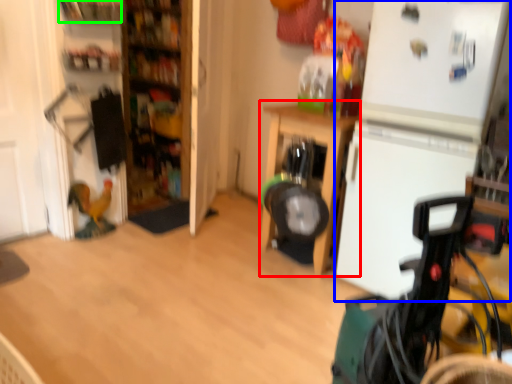
Question: Which object is positioned farthest from furniture (highlighted by a red box)? Select from fridge (highlighted by a blue box) and shelf (highlighted by a green box).

Choices:
 (A) fridge
 (B) shelf

Answer: (B)